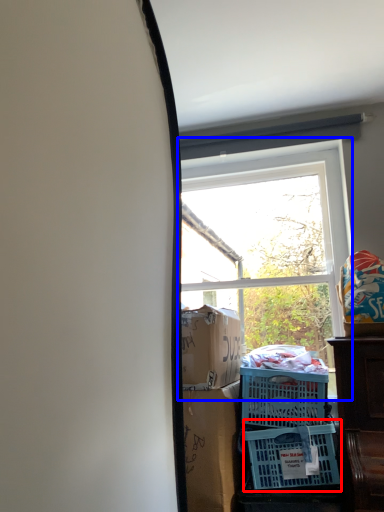
Question: Among these objects, which one is farthest to the camera, basket (highlighted by a red box) or window (highlighted by a blue box)?

Choices:
 (A) basket
 (B) window

Answer: (B)